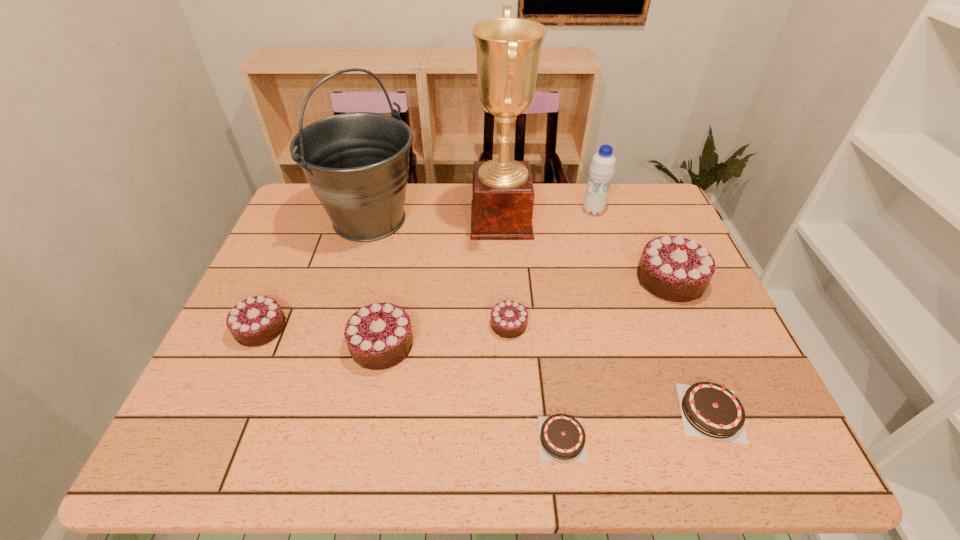
Image resolution: width=960 pixels, height=540 pixels. Identify the location of the tallest object. click(x=293, y=436).

I want to click on gray bucket, so click(x=293, y=436).

Find the location of `the eighth shortest object`. the eighth shortest object is located at coordinates (293, 436).

Locate an element on the screen. blue water bottle is located at coordinates (293, 436).

Locate an element on the screen. Image resolution: width=960 pixels, height=540 pixels. the seventh object from left to right is located at coordinates (293, 436).

The width and height of the screenshot is (960, 540). Identify the location of the fourth farthest object. (627, 309).

Where is `the sixth shortest object`? This screenshot has width=960, height=540. the sixth shortest object is located at coordinates (627, 309).

You are a GUI agent. You are given a task and a screenshot of the screen. Output one action in this format:
    pyautogui.click(x=<x>, y=<y>)
    Task: Click on the second biggest chocolate chocolate cake
    The image size is (960, 540).
    Given the screenshot: What is the action you would take?
    pyautogui.click(x=387, y=404)

Locate an element on the screen. the fifth shortest chocolate cake is located at coordinates (387, 404).

This screenshot has height=540, width=960. What are the coordinates of `the second smallest chocolate chocolate cake` in the screenshot? It's located at (251, 417).